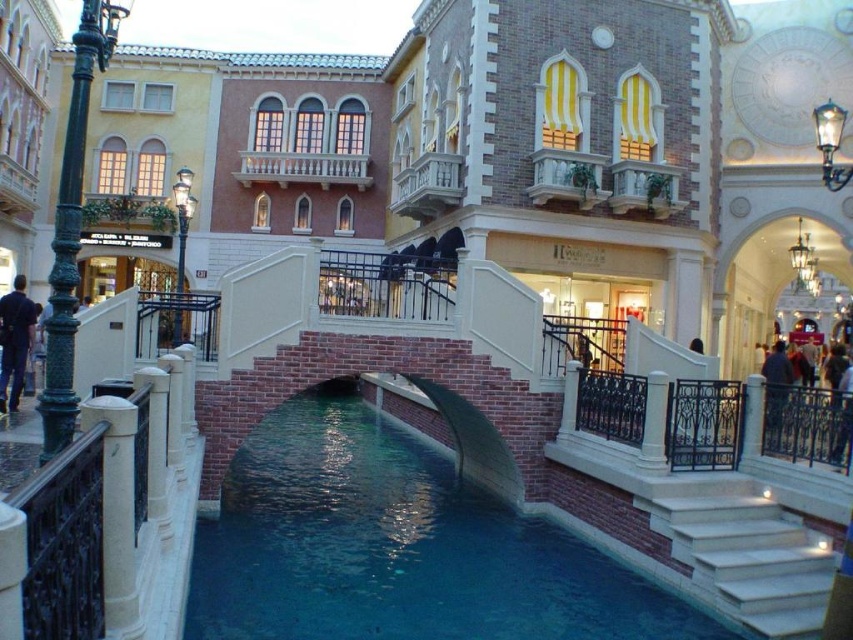
Question: Does white marble stairs at lower right appear on the left side of dark blue fabric jacket at lower left?

Choices:
 (A) yes
 (B) no

Answer: (B)

Question: Based on their relative distances, which object is nearer to the blue smooth water at center?

Choices:
 (A) dark blue fabric jacket at lower left
 (B) white marble stairs at lower right

Answer: (B)

Question: Which object is farther from the camera taking this photo?

Choices:
 (A) blue smooth water at center
 (B) white marble stairs at lower right
 (C) dark blue fabric jacket at lower left

Answer: (C)

Question: Does blue smooth water at center come in front of dark blue fabric jacket at lower left?

Choices:
 (A) no
 (B) yes

Answer: (B)

Question: Which object is closer to the camera taking this photo?

Choices:
 (A) blue smooth water at center
 (B) dark blue fabric jacket at lower left

Answer: (A)

Question: Does blue smooth water at center have a larger size compared to dark blue fabric jacket at lower left?

Choices:
 (A) no
 (B) yes

Answer: (A)